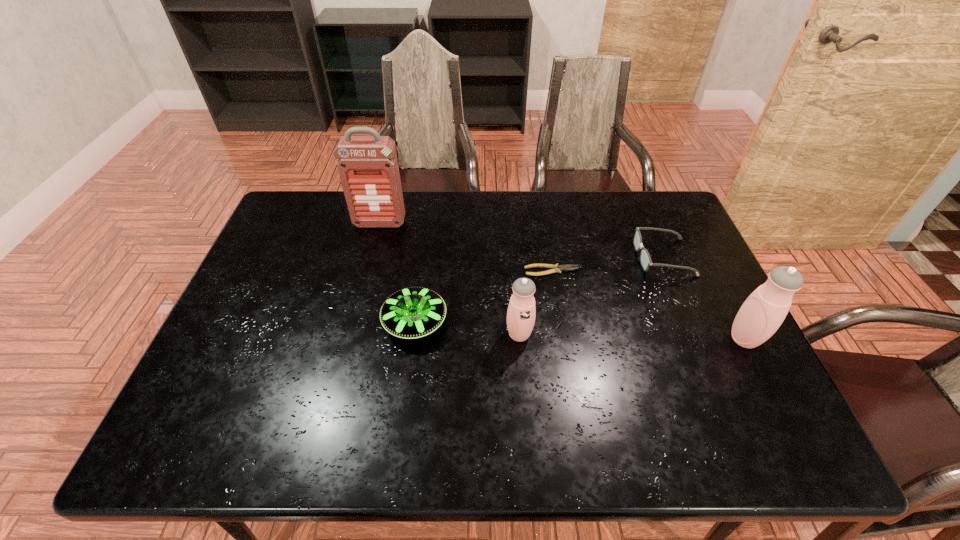
I want to click on vacant space located 0.140m on the left of the taller thermos bottle, so click(x=672, y=339).

Find the location of `vacant space situated 0.150m on the front-facing side of the tallest object`. vacant space situated 0.150m on the front-facing side of the tallest object is located at coordinates (371, 261).

What are the coordinates of `blank space located 0.280m on the left of the pliers` in the screenshot? It's located at [428, 271].

This screenshot has width=960, height=540. In order to click on vacant space positioned 0.230m on the right of the saucer in this screenshot , I will do `click(535, 322)`.

Locate an element on the screen. The image size is (960, 540). free region located 0.330m on the face of the spectacles is located at coordinates (526, 257).

Locate an element on the screen. The width and height of the screenshot is (960, 540). vacant area located 0.060m on the face of the spectacles is located at coordinates (616, 257).

Identify the location of free space located 0.200m on the face of the spectacles. This screenshot has width=960, height=540. (569, 257).

Locate an element on the screen. The width and height of the screenshot is (960, 540). object at the far edge is located at coordinates (368, 168).

Identify the location of thermos bottle that is at the right edge. The image size is (960, 540). [x=762, y=313].

At what (x,y) coordinates should I click in order to perform the action: click on spectacles positioned at the right edge. Please return your answer as a coordinate pair (x, y). The width and height of the screenshot is (960, 540). Looking at the image, I should click on (645, 260).